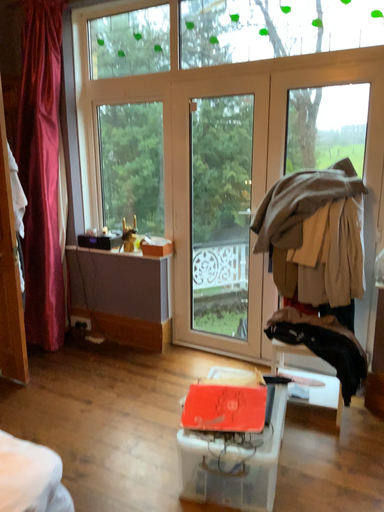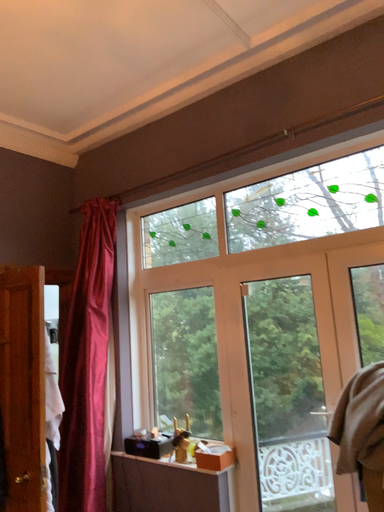
Question: How did the camera likely rotate when shooting the video?

Choices:
 (A) rotated upward
 (B) rotated downward

Answer: (A)